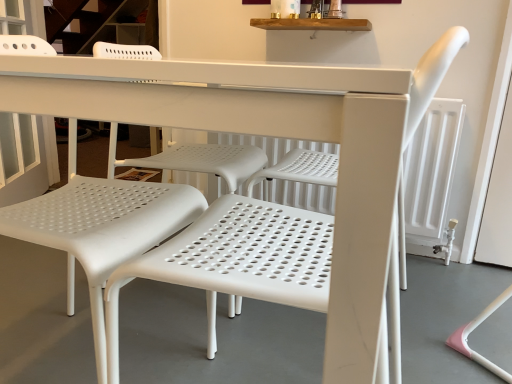
Question: Does point (65, 236) appear closer or farther from the camera than point (286, 281)?

Choices:
 (A) closer
 (B) farther

Answer: (B)

Question: Is white perforated plastic chair at left, the first chair viewed from the left, wider or thinner than white perforated plastic chair at center, acting as the 1th chair starting from the right?

Choices:
 (A) wide
 (B) thin

Answer: (A)

Question: Relative to white perforated plastic chair at center, which ranks as the second chair in left-to-right order, is white perforated plastic chair at left, the first chair viewed from the left, in front or behind?

Choices:
 (A) front
 (B) behind

Answer: (B)

Question: Considering the positions of white perforated plastic chair at center, acting as the 1th chair starting from the right, and white perforated plastic chair at left, which appears as the 2th chair when viewed from the right, in the image, is white perforated plastic chair at center, acting as the 1th chair starting from the right, taller or shorter than white perforated plastic chair at left, which appears as the 2th chair when viewed from the right,?

Choices:
 (A) tall
 (B) short

Answer: (B)

Question: Is white perforated plastic chair at center, which ranks as the second chair in left-to-right order, wider or thinner than white perforated plastic chair at left, which appears as the 2th chair when viewed from the right?

Choices:
 (A) thin
 (B) wide

Answer: (A)

Question: Based on their sizes in the image, would you say white perforated plastic chair at center, which ranks as the second chair in left-to-right order, is bigger or smaller than white perforated plastic chair at left, the first chair viewed from the left?

Choices:
 (A) big
 (B) small

Answer: (B)

Question: Is white perforated plastic chair at center, which ranks as the second chair in left-to-right order, inside the boundaries of white perforated plastic chair at left, which appears as the 2th chair when viewed from the right, or outside?

Choices:
 (A) outside
 (B) inside

Answer: (A)